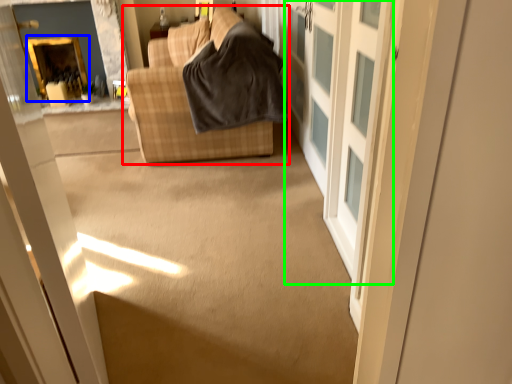
Question: Estimate the real-world distances between objects in this image. Which object is closer to studio couch (highlighted by a red box), fireplace (highlighted by a blue box) or barn door (highlighted by a green box)?

Choices:
 (A) fireplace
 (B) barn door

Answer: (B)